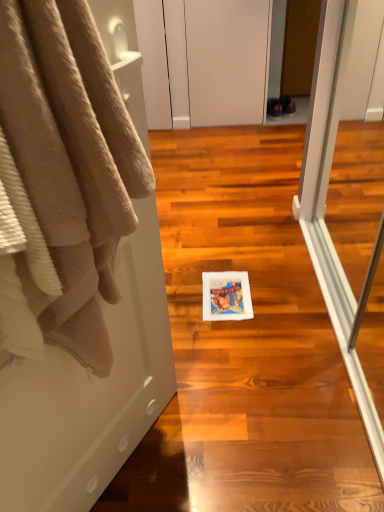
Question: Considering the relative sizes of beige plush towel at left and white matte cabinet at upper center in the image provided, is beige plush towel at left bigger than white matte cabinet at upper center?

Choices:
 (A) no
 (B) yes

Answer: (A)

Question: Can you confirm if beige plush towel at left is positioned to the right of white matte cabinet at upper center?

Choices:
 (A) no
 (B) yes

Answer: (A)

Question: Is beige plush towel at left taller than white matte cabinet at upper center?

Choices:
 (A) yes
 (B) no

Answer: (B)

Question: Considering the relative sizes of beige plush towel at left and white matte cabinet at upper center in the image provided, is beige plush towel at left shorter than white matte cabinet at upper center?

Choices:
 (A) yes
 (B) no

Answer: (A)

Question: Is beige plush towel at left not within white matte cabinet at upper center?

Choices:
 (A) yes
 (B) no

Answer: (A)

Question: From the image's perspective, is white matte cabinet at upper center above or below white paper towel at center?

Choices:
 (A) above
 (B) below

Answer: (A)

Question: Relative to white paper towel at center, is white matte cabinet at upper center in front or behind?

Choices:
 (A) behind
 (B) front

Answer: (A)

Question: Is white matte cabinet at upper center bigger or smaller than white paper towel at center?

Choices:
 (A) big
 (B) small

Answer: (B)

Question: In terms of height, does white matte cabinet at upper center look taller or shorter compared to white paper towel at center?

Choices:
 (A) tall
 (B) short

Answer: (A)

Question: Considering the positions of point (231, 368) and point (89, 239), is point (231, 368) closer or farther from the camera than point (89, 239)?

Choices:
 (A) closer
 (B) farther

Answer: (B)

Question: Based on their sizes in the image, would you say white paper towel at center is bigger or smaller than beige plush towel at left?

Choices:
 (A) big
 (B) small

Answer: (A)

Question: Is white paper towel at center wider or thinner than beige plush towel at left?

Choices:
 (A) thin
 (B) wide

Answer: (B)

Question: From a real-world perspective, is white paper towel at center above or below beige plush towel at left?

Choices:
 (A) below
 (B) above

Answer: (A)

Question: In terms of width, does white paper towel at center look wider or thinner when compared to white matte cabinet at upper center?

Choices:
 (A) thin
 (B) wide

Answer: (B)

Question: Would you say white paper towel at center is inside or outside white matte cabinet at upper center?

Choices:
 (A) inside
 (B) outside

Answer: (B)